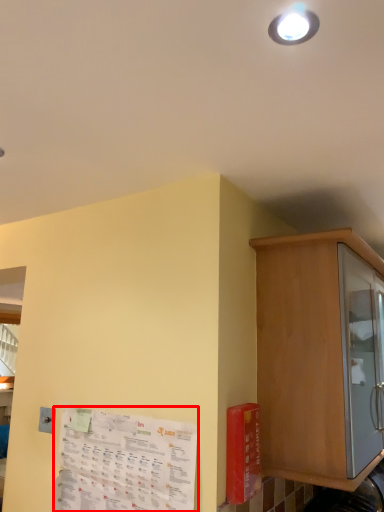
Question: Considering the relative positions of paper (annotated by the red box) and cabinetry in the image provided, where is paper (annotated by the red box) located with respect to the staircase?

Choices:
 (A) left
 (B) right

Answer: (A)